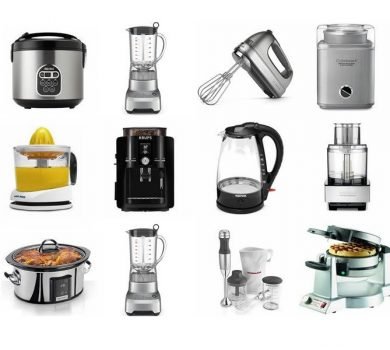
Where is `black based transparent liquid container with handle`? black based transparent liquid container with handle is located at coordinates (232, 162).